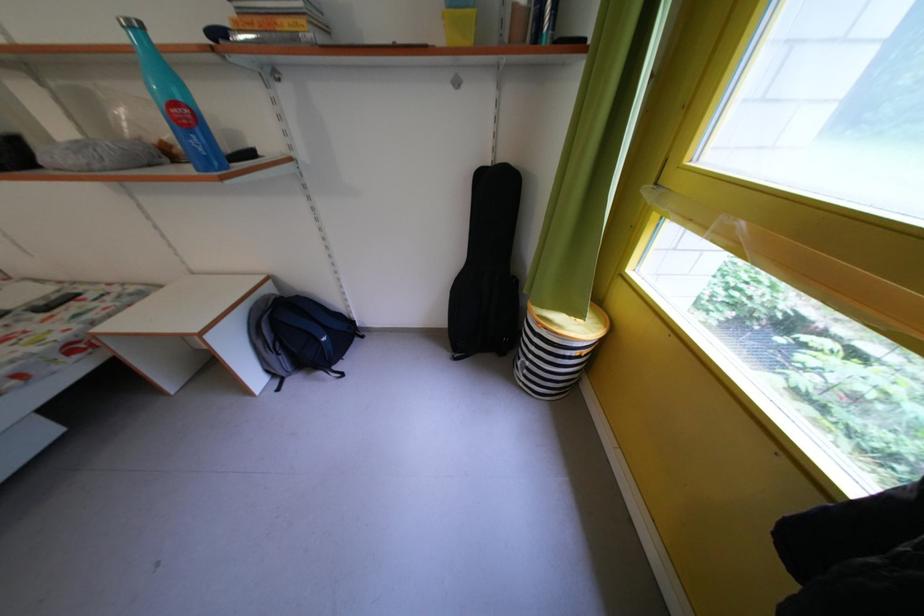
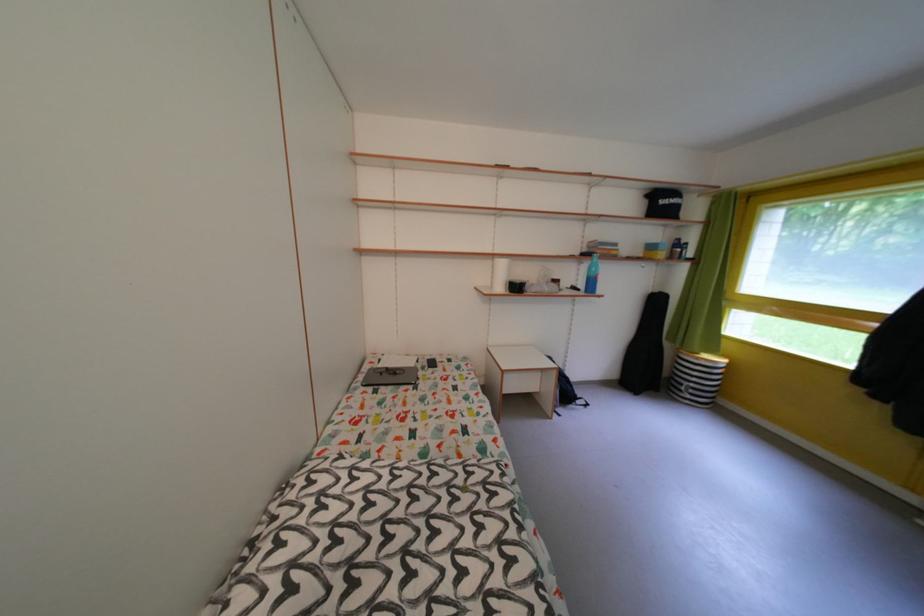
What movement of the cameraman would produce the second image?

The cameraman walked toward left, backward.